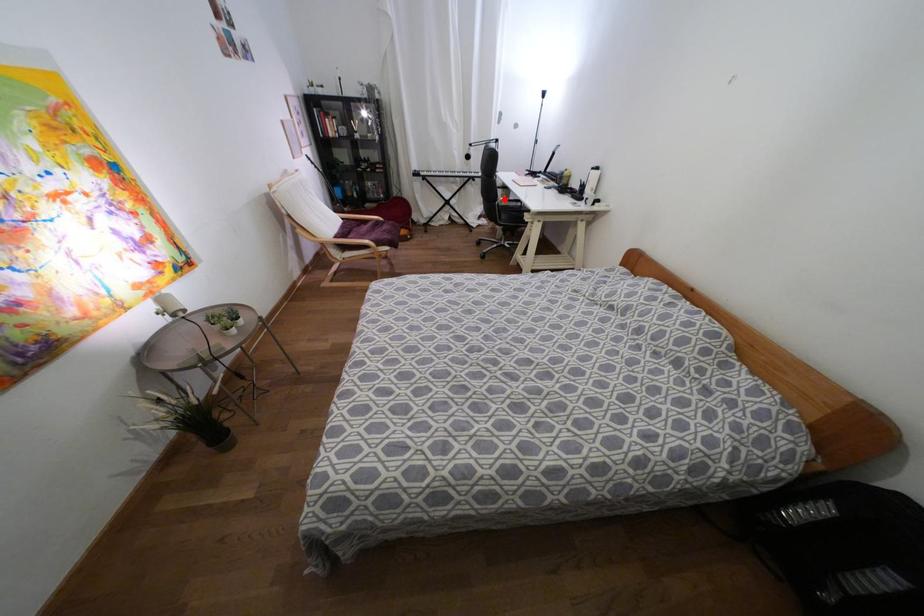
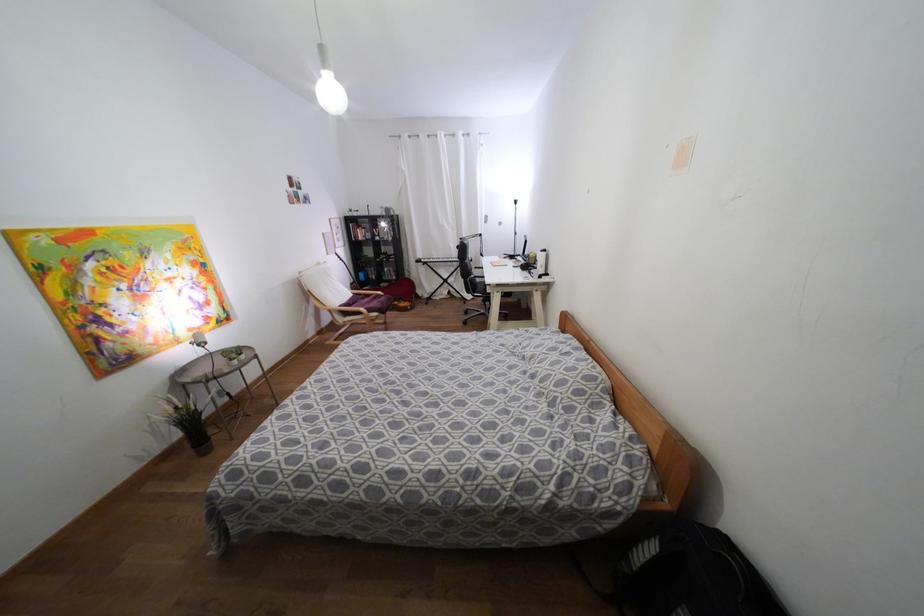
Find the pixel in the second image that matches the highlighted location in the first image.

(475, 276)